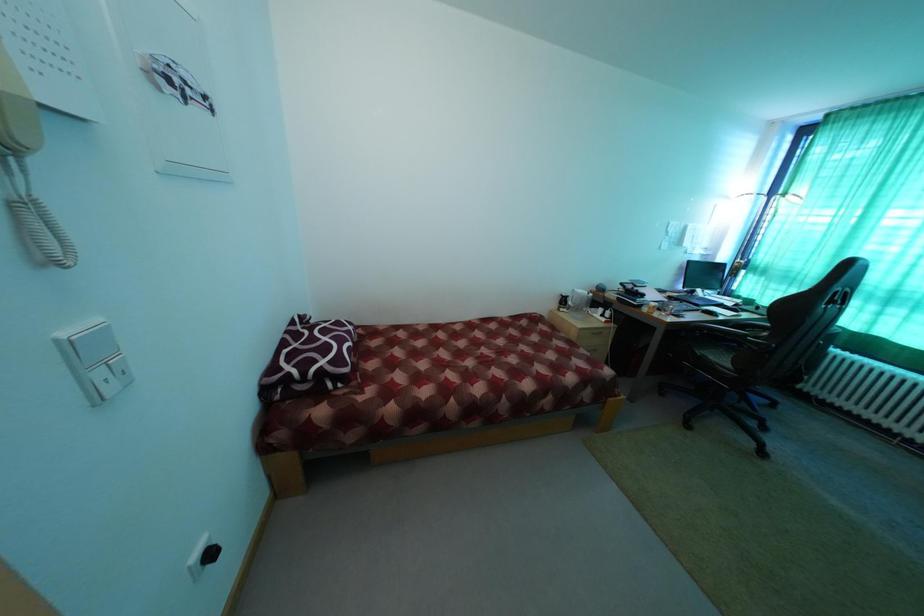
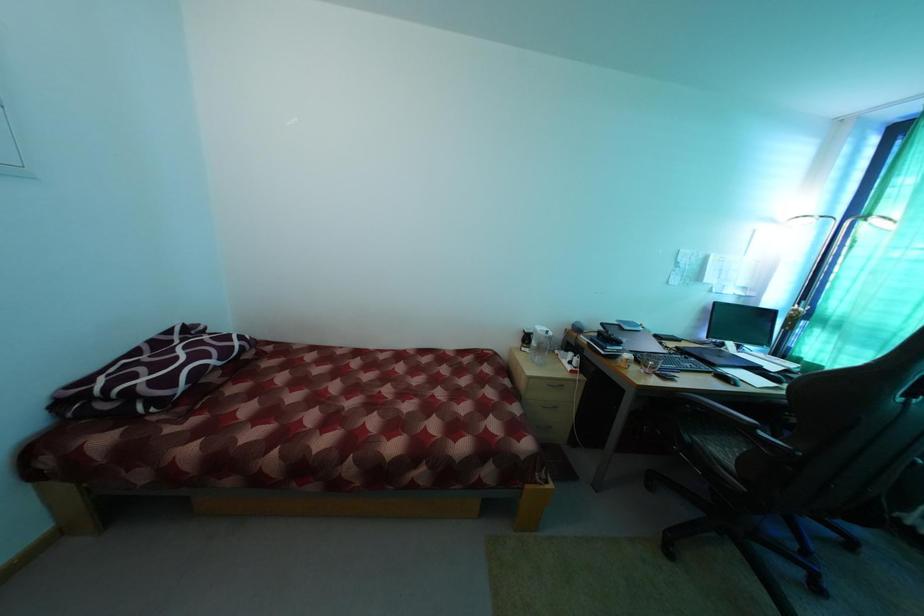
Question: The camera is either moving clockwise (left) or counter-clockwise (right) around the object. The first image is from the beginning of the video and the second image is from the end. Is the camera moving left or right when shooting the video?

Choices:
 (A) Left
 (B) Right

Answer: (B)